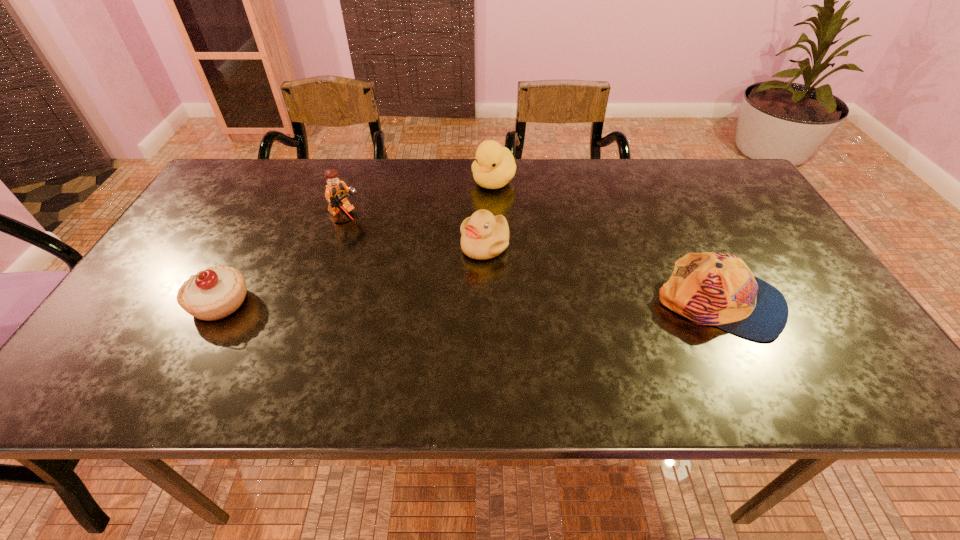
Where is `pastry`? This screenshot has width=960, height=540. pastry is located at coordinates (212, 294).

Where is `the rightmost object`? This screenshot has width=960, height=540. the rightmost object is located at coordinates (710, 288).

Where is `the farthest object`? the farthest object is located at coordinates (494, 167).

The height and width of the screenshot is (540, 960). I want to click on duckling, so click(x=484, y=236).

Image resolution: width=960 pixels, height=540 pixels. In order to click on Lego in this screenshot , I will do `click(336, 191)`.

I want to click on free space located 0.240m on the back of the pastry, so click(265, 218).

Locate an element on the screen. This screenshot has width=960, height=540. vacant point located on the bill of the cap is located at coordinates (824, 304).

This screenshot has width=960, height=540. Identify the location of free space located on the front-facing side of the duck. (441, 261).

Identify the location of vacant space located on the front-facing side of the duck. (445, 253).

This screenshot has width=960, height=540. In order to click on vacant space located on the front-facing side of the duck in this screenshot , I will do `click(472, 215)`.